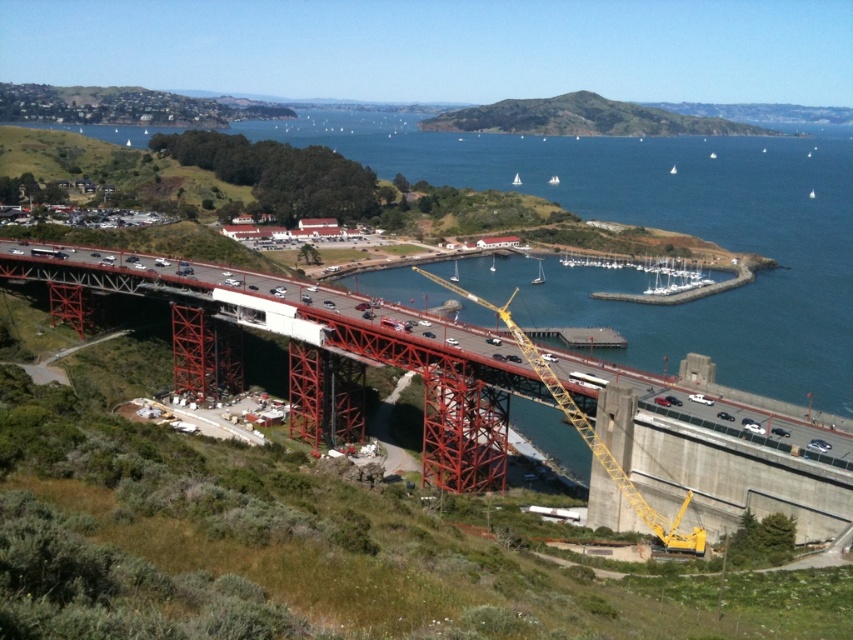
Question: Which point is closer to the camera?

Choices:
 (A) blue water at center
 (B) yellow metallic crane at center
 (C) white sailboat at upper center

Answer: (B)

Question: In this image, where is white sailboat at upper center located relative to white plastic sailboat at upper center?

Choices:
 (A) left
 (B) right

Answer: (A)

Question: Does green grassy hillside at upper center have a greater width compared to yellow metallic crane at center?

Choices:
 (A) yes
 (B) no

Answer: (A)

Question: Which point appears closest to the camera in this image?

Choices:
 (A) (532, 362)
 (B) (726, 122)
 (C) (704, 337)

Answer: (A)

Question: Is blue water at center in front of green grassy hillside at upper center?

Choices:
 (A) yes
 (B) no

Answer: (A)

Question: Which is farther from the blue water at center?

Choices:
 (A) white plastic boat at center
 (B) white sailboat at upper center

Answer: (B)